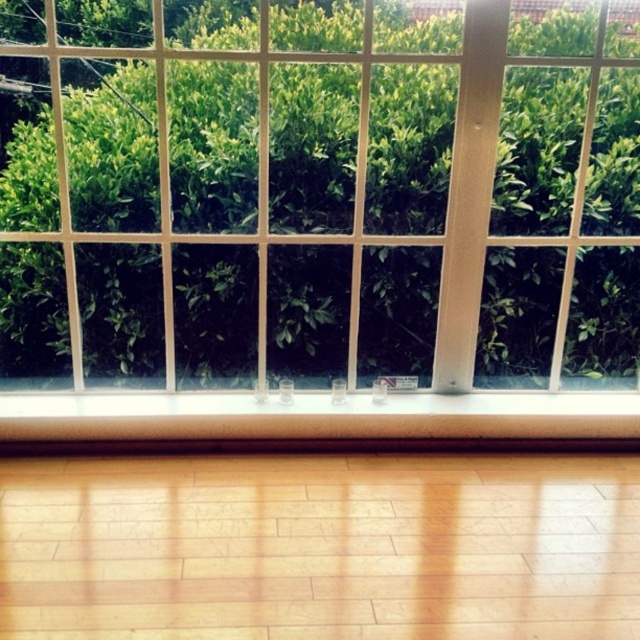
Question: Does clear glass window at center appear over wooden at lower center?

Choices:
 (A) no
 (B) yes

Answer: (B)

Question: Among these points, which one is nearest to the camera?

Choices:
 (A) (294, 324)
 (B) (36, 422)

Answer: (B)

Question: Does clear glass window at center have a smaller size compared to wooden at lower center?

Choices:
 (A) yes
 (B) no

Answer: (B)

Question: Does clear glass window at center have a greater width compared to wooden at lower center?

Choices:
 (A) yes
 (B) no

Answer: (A)

Question: Which object is farther from the camera taking this photo?

Choices:
 (A) wooden at lower center
 (B) clear glass window at center

Answer: (A)